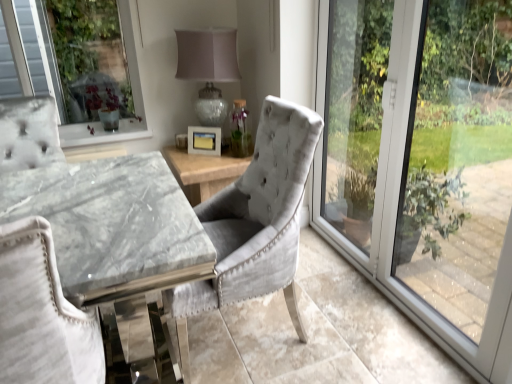
The height and width of the screenshot is (384, 512). I want to click on free space to the left of transparent glass window at right, so click(x=323, y=296).